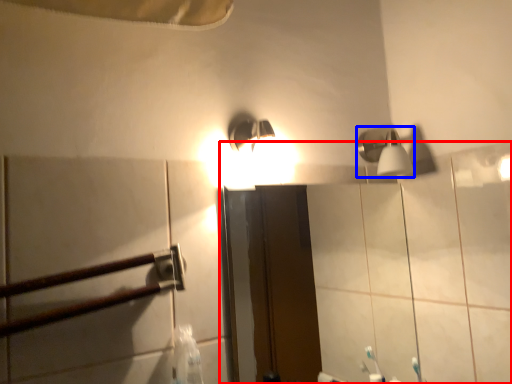
Question: Which of the following is the closest to the observer, mirror (highlighted by a red box) or shower (highlighted by a blue box)?

Choices:
 (A) mirror
 (B) shower

Answer: (A)